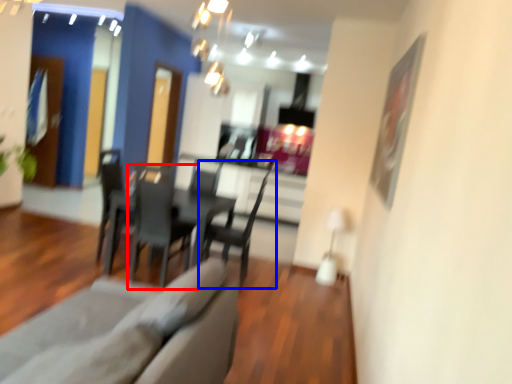
Question: Among these objects, which one is farthest to the camera, chair (highlighted by a red box) or chair (highlighted by a blue box)?

Choices:
 (A) chair
 (B) chair

Answer: (B)